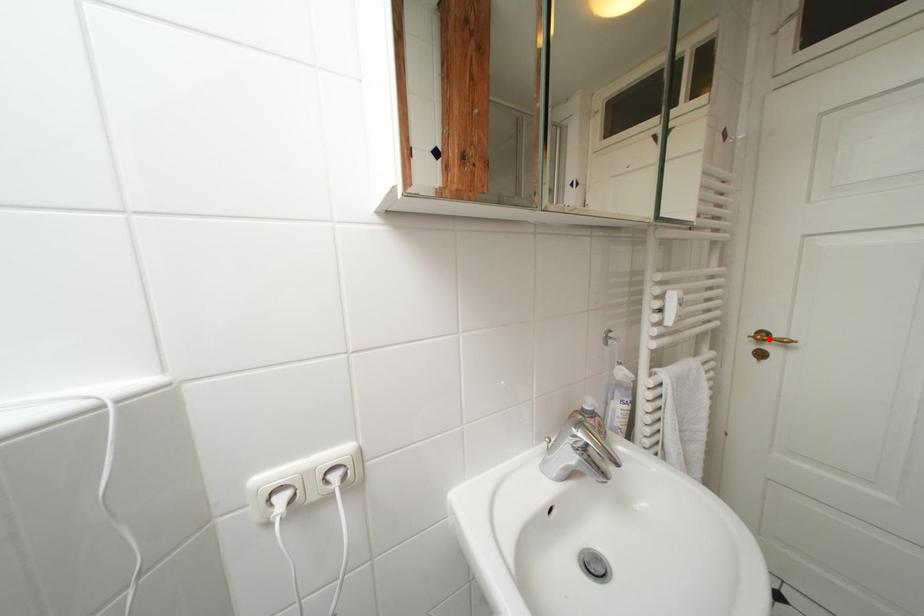
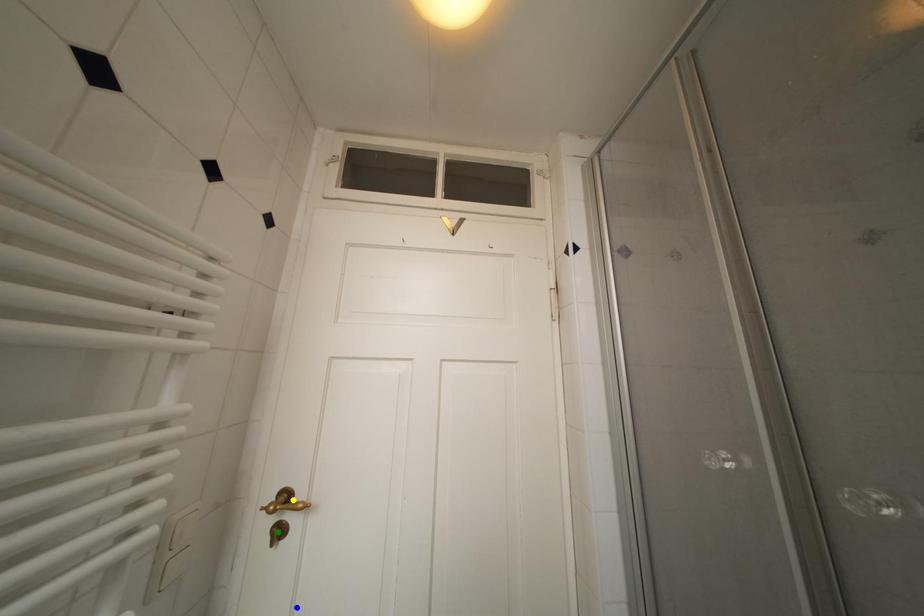
Question: I am providing you with two images of the same scene from different viewpoints. A red point is marked on the first image. You are given multiple points on the second image. Can you choose the point in image 2 that corresponds to the point in image 1?

Choices:
 (A) yellow point
 (B) blue point
 (C) green point

Answer: (A)